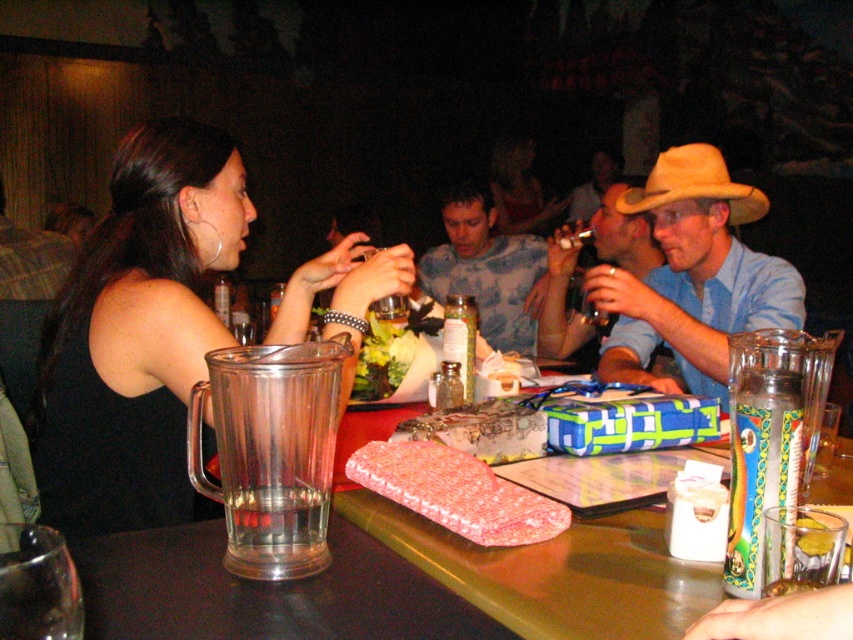
You are a waiter at a restaurant. You need to place a 12 inch wide dessert plate on the table without moving any existing items. The table has a pink fabric purse at table center. Can you fit the dessert plate on the table without overlapping any items?

The pink fabric purse at table center is 29.34 inches away from the camera. Since the dessert plate is only 12 inches wide, there is sufficient space on the table to place it without overlapping any items, provided the purse is centered and other items are arranged around it.